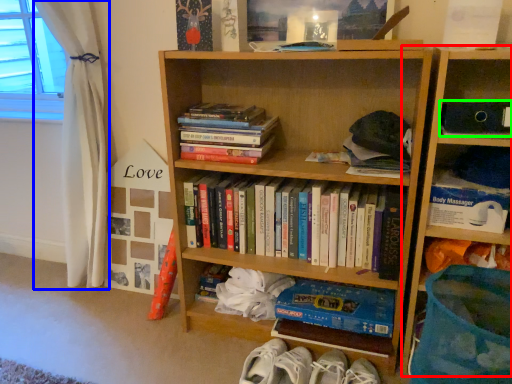
Question: Considering the real-world distances, which object is closest to bookcase (highlighted by a red box)? curtain (highlighted by a blue box) or paperback book (highlighted by a green box).

Choices:
 (A) curtain
 (B) paperback book

Answer: (B)